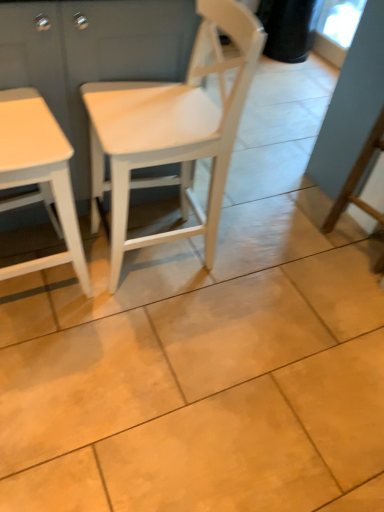
The height and width of the screenshot is (512, 384). What are the coordinates of `vacant area situated below white matte table at left (from a real-world perspective)` in the screenshot? It's located at (43, 281).